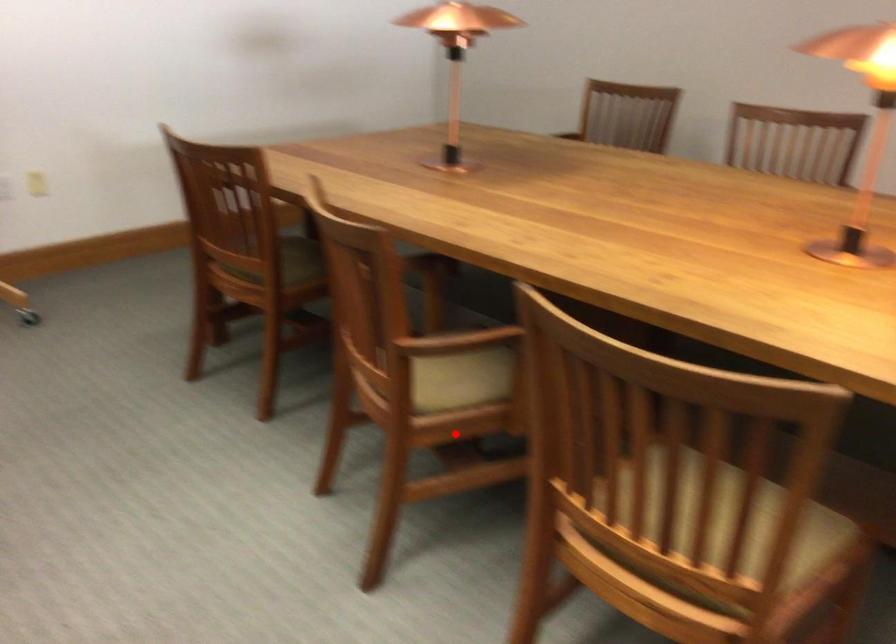
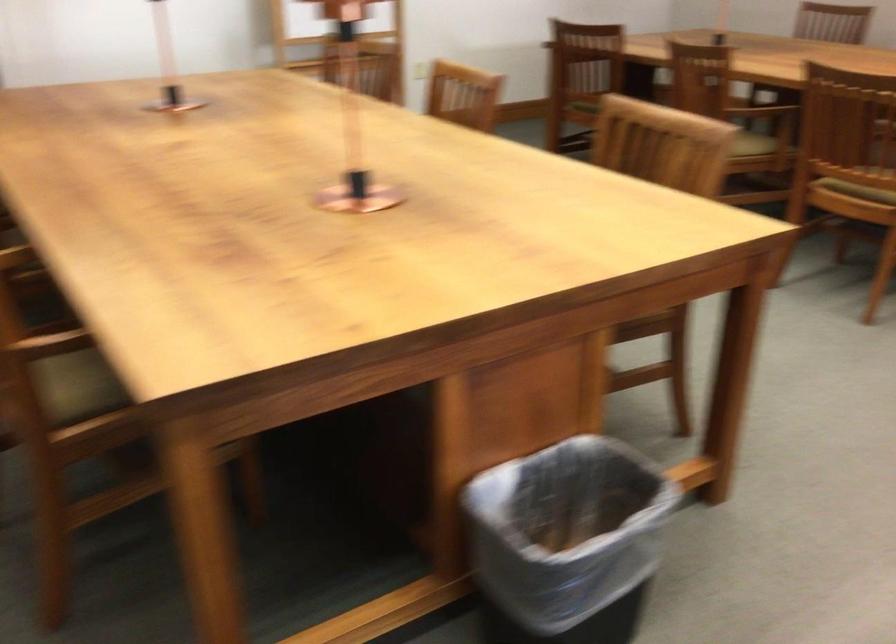
The point at the highlighted location is marked in the first image. Where is the corresponding point in the second image?

(753, 144)